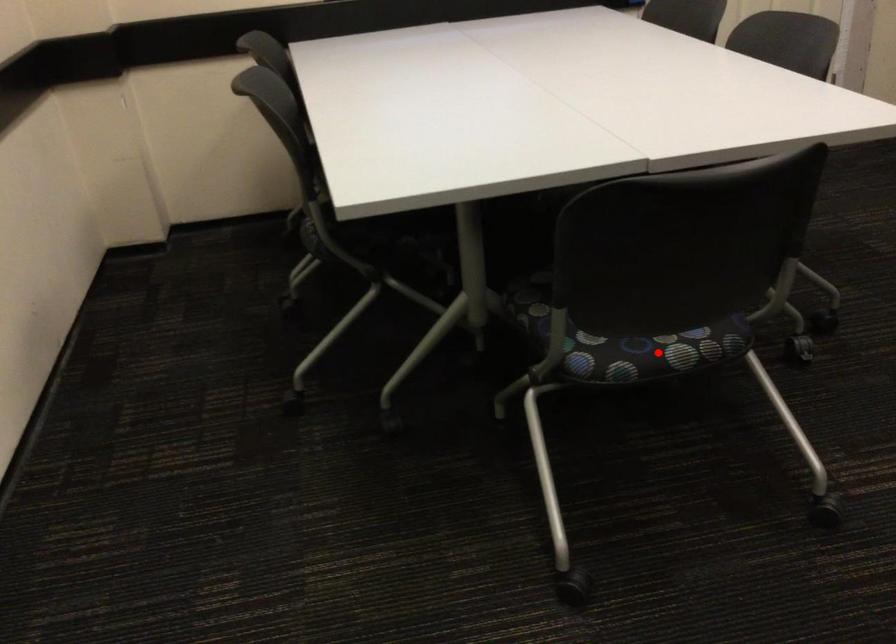
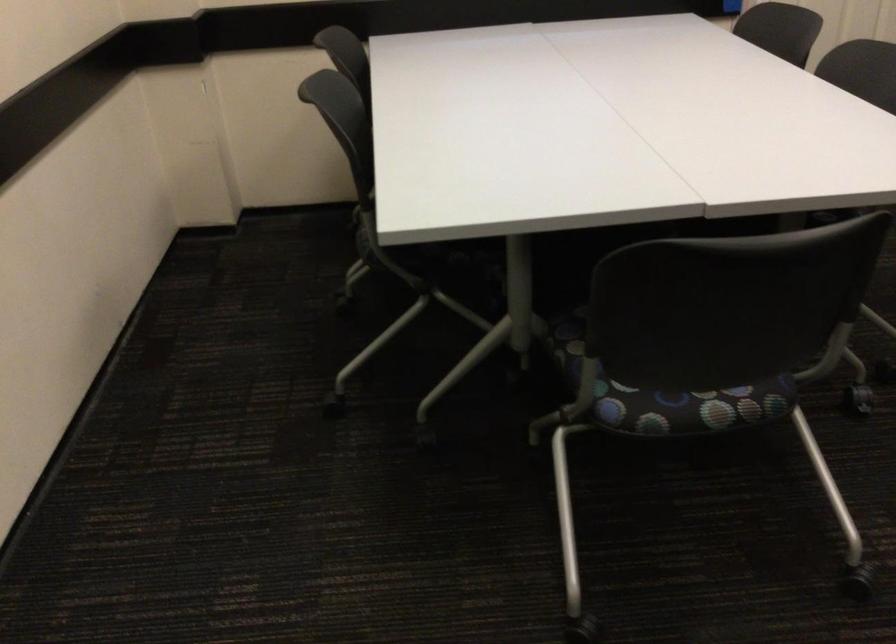
Locate, in the second image, the point that corresponds to the highlighted location in the first image.

(688, 406)